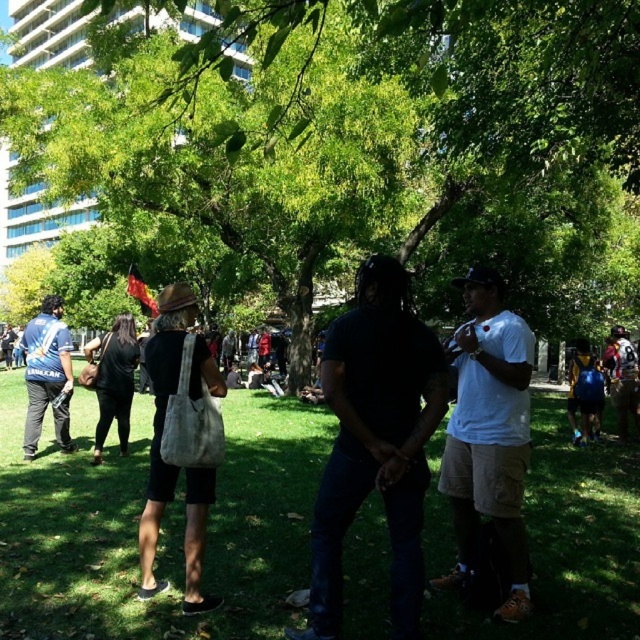
Based on the photo, you are standing in the park and see two points marked in the scene. Which point is closer to you, point (38, 371) or point (212, 604)?

Point (38, 371) is closer to you because it is further to the viewer than point (212, 604).

You are standing in the park and want to place a picnic blanket on the green grass at center. According to the coordinates provided, where exactly should you place it?

The green grass at center should be placed at coordinates point (x=161, y=524).